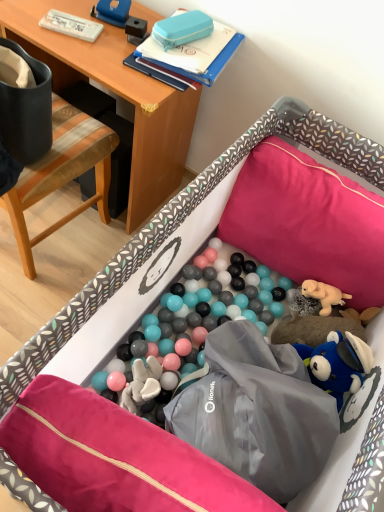
Question: Can you confirm if pink fabric pillow at center, which ranks as the 1th pillow in front-to-back order, is wider than woodenchair at left?

Choices:
 (A) yes
 (B) no

Answer: (B)

Question: Is woodenchair at left at the back of pink fabric pillow at center, which ranks as the 1th pillow in front-to-back order?

Choices:
 (A) yes
 (B) no

Answer: (B)

Question: Is woodenchair at left surrounded by pink fabric pillow at center, which is the first pillow in left-to-right order?

Choices:
 (A) no
 (B) yes

Answer: (A)

Question: Are pink fabric pillow at center, which appears as the 2th pillow when viewed from the back, and woodenchair at left far apart?

Choices:
 (A) no
 (B) yes

Answer: (A)

Question: Is pink fabric pillow at center, which ranks as the 1th pillow in front-to-back order, positioned behind woodenchair at left?

Choices:
 (A) yes
 (B) no

Answer: (B)

Question: Is point (175, 15) closer or farther from the camera than point (231, 241)?

Choices:
 (A) closer
 (B) farther

Answer: (A)

Question: Considering the positions of blue hard plastic case at upper center and pink fabric pillow at upper right, which is counted as the second pillow, starting from the left, in the image, is blue hard plastic case at upper center bigger or smaller than pink fabric pillow at upper right, which is counted as the second pillow, starting from the left,?

Choices:
 (A) small
 (B) big

Answer: (A)

Question: Is blue hard plastic case at upper center in front of or behind pink fabric pillow at upper right, which is counted as the second pillow, starting from the left, in the image?

Choices:
 (A) behind
 (B) front

Answer: (A)

Question: Considering the positions of blue hard plastic case at upper center and pink fabric pillow at upper right, which ranks as the first pillow in back-to-front order, in the image, is blue hard plastic case at upper center wider or thinner than pink fabric pillow at upper right, which ranks as the first pillow in back-to-front order,?

Choices:
 (A) wide
 (B) thin

Answer: (B)

Question: In the image, is pink fabric pillow at upper right, which is counted as the second pillow, starting from the left, on the left side or the right side of pink fabric pillow at center, which appears as the 2th pillow when viewed from the back?

Choices:
 (A) left
 (B) right

Answer: (B)

Question: Is point (369, 296) closer or farther from the camera than point (33, 428)?

Choices:
 (A) closer
 (B) farther

Answer: (B)

Question: Is pink fabric pillow at upper right, the 2th pillow positioned from the front, in front of or behind pink fabric pillow at center, which appears as the 2th pillow when viewed from the back, in the image?

Choices:
 (A) front
 (B) behind

Answer: (B)

Question: Considering the positions of pink fabric pillow at upper right, which ranks as the first pillow in back-to-front order, and pink fabric pillow at center, which is the second pillow in top-to-bottom order, in the image, is pink fabric pillow at upper right, which ranks as the first pillow in back-to-front order, wider or thinner than pink fabric pillow at center, which is the second pillow in top-to-bottom order,?

Choices:
 (A) thin
 (B) wide

Answer: (B)

Question: From a real-world perspective, is wooden desk at upper left above or below pink fabric pillow at upper right, placed as the 2th pillow when sorted from bottom to top?

Choices:
 (A) below
 (B) above

Answer: (A)

Question: Do you think wooden desk at upper left is within pink fabric pillow at upper right, placed as the 2th pillow when sorted from bottom to top, or outside of it?

Choices:
 (A) inside
 (B) outside

Answer: (B)